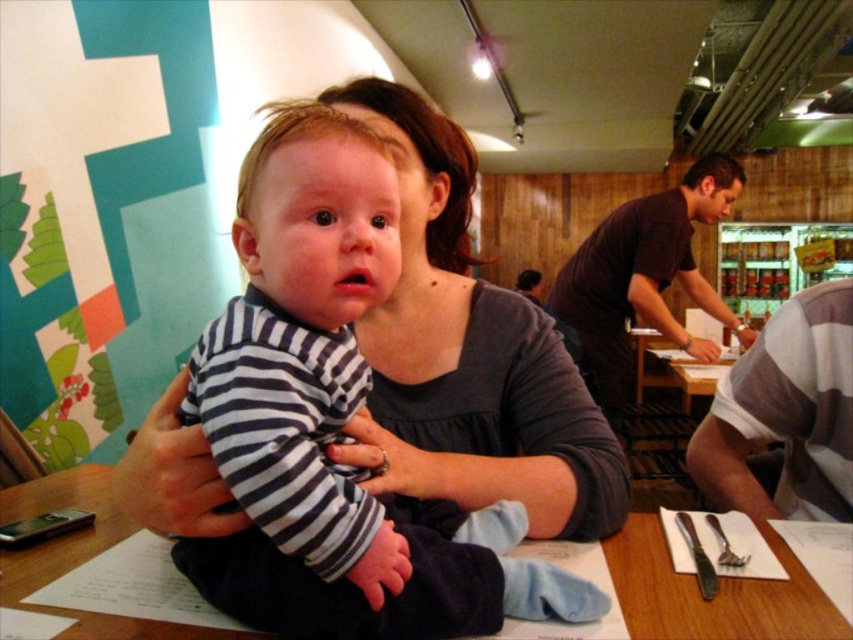
You are a parent holding a baby and want to place a toy on the table so that the baby can reach it easily. The baby is currently at point (257,193). Where should you place the toy so that it is within the baby s reach?

The toy should be placed within 20.25 inches from the baby s current position at point (257,193) to ensure it is within reach.

You are a customer in a restaurant and see the striped cotton shirt at center and the gray striped shirt at lower right. Which one is higher up in the image?

The striped cotton shirt at center is located above the gray striped shirt at lower right, so it is higher up in the image.